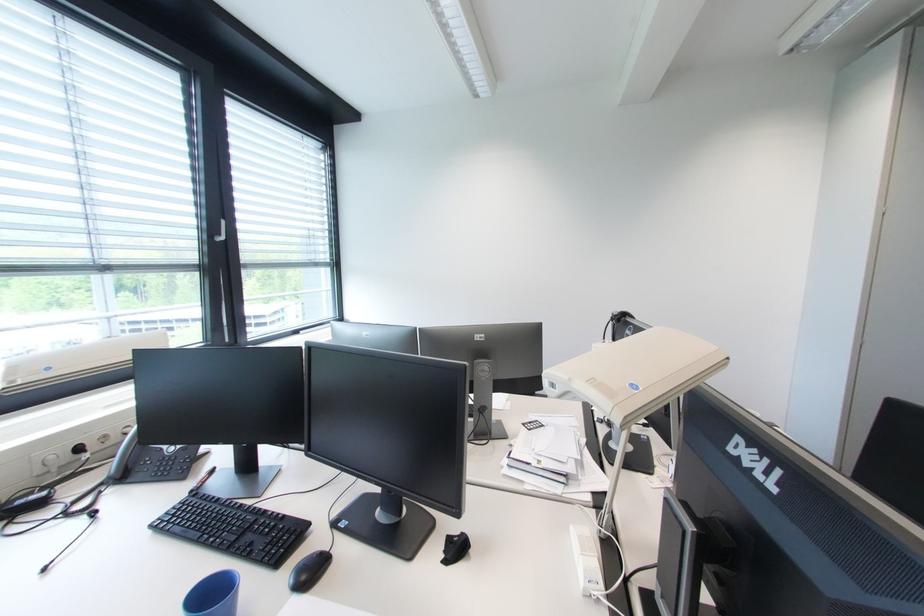
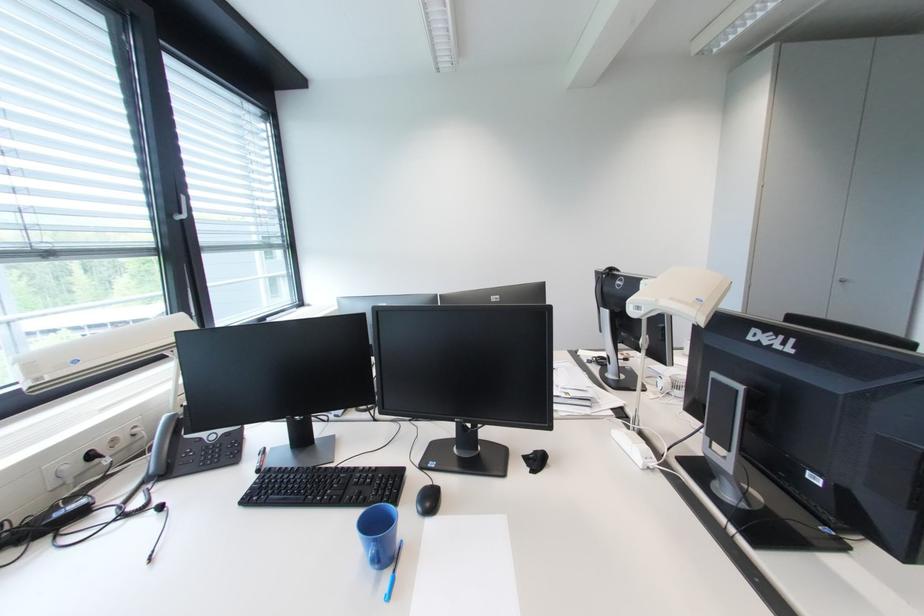
The point at (x=468, y=536) is marked in the first image. Where is the corresponding point in the second image?

(541, 454)